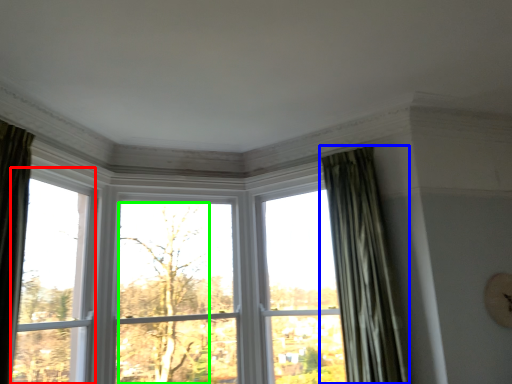
Question: Based on their relative distances, which object is farther from window (highlighted by a red box)? Choose from curtain (highlighted by a blue box) and tree (highlighted by a green box).

Choices:
 (A) curtain
 (B) tree

Answer: (A)